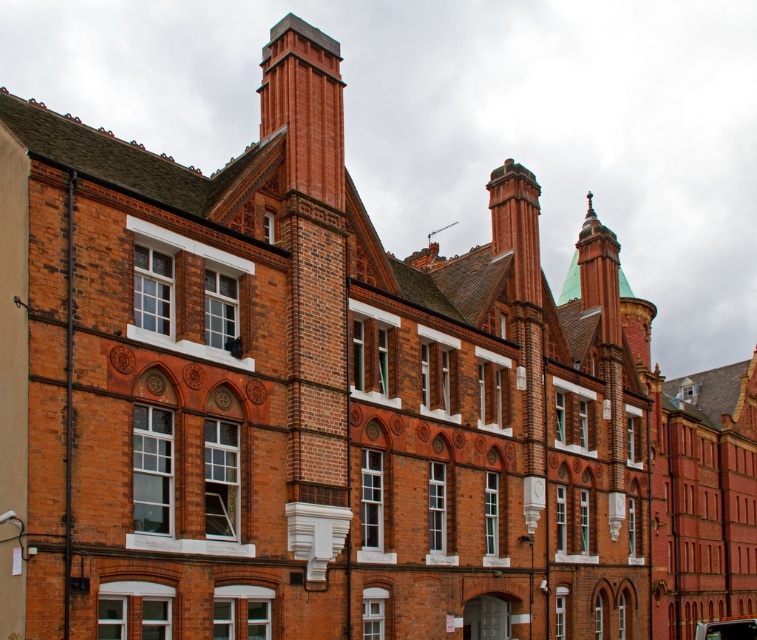
Which is above, brick chimney at upper center or red brick chimney at upper center?

brick chimney at upper center is higher up.

What do you see at coordinates (304, 108) in the screenshot?
I see `brick chimney at upper center` at bounding box center [304, 108].

This screenshot has width=757, height=640. In order to click on brick chimney at upper center in this screenshot , I will do `click(304, 108)`.

Does red brick chimney at upper center have a greater width compared to shiny black car at bottom right?

Incorrect, red brick chimney at upper center's width does not surpass shiny black car at bottom right's.

Consider the image. Measure the distance between point (497, 196) and camera.

Point (497, 196) is 73.27 meters from camera.

You are a GUI agent. You are given a task and a screenshot of the screen. Output one action in this format:
    pyautogui.click(x=<x>, y=<y>)
    Task: Click on the red brick chimney at upper center
    This screenshot has width=757, height=640.
    Given the screenshot: What is the action you would take?
    pyautogui.click(x=516, y=225)

Between brick chimney at upper center and shiny black car at bottom right, which one has less height?

Standing shorter between the two is brick chimney at upper center.

Does point (282, 109) come farther from viewer compared to point (740, 636)?

That is False.

In order to click on brick chimney at upper center in this screenshot , I will do `click(304, 108)`.